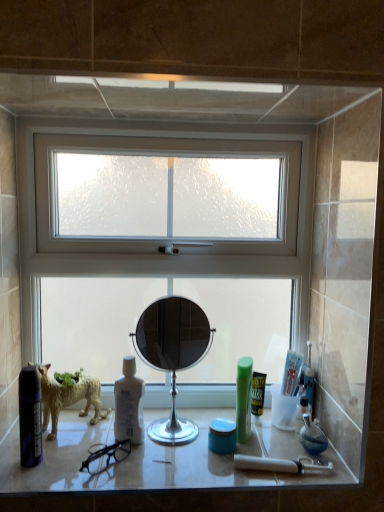
This screenshot has width=384, height=512. I want to click on free location in front of speckled ceramic figurine at lower left, so click(x=74, y=466).